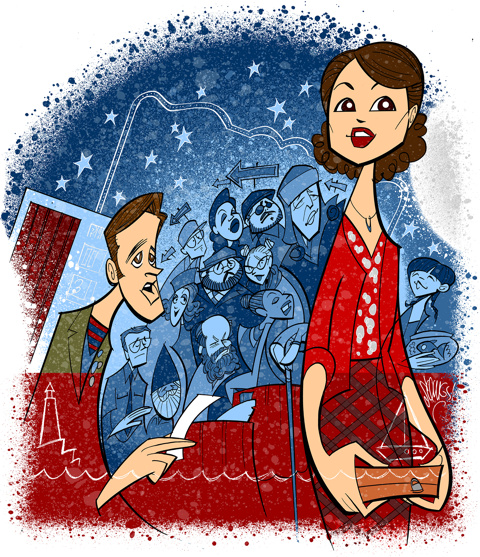
You are a GUI agent. You are given a task and a screenshot of the screen. Output one action in this format:
    pyautogui.click(x=<x>, y=<y>)
    Task: Click on the locked box
    This screenshot has height=557, width=480.
    Given the screenshot: What is the action you would take?
    pyautogui.click(x=418, y=481), pyautogui.click(x=393, y=483), pyautogui.click(x=384, y=483), pyautogui.click(x=365, y=480), pyautogui.click(x=408, y=469)